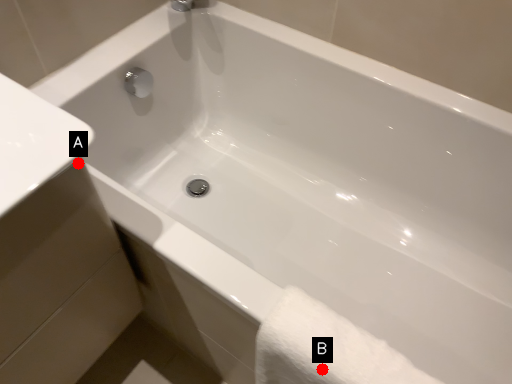
Question: Two points are circled on the image, labeled by A and B beside each circle. Which of the following is the closest to the observer?

Choices:
 (A) A is closer
 (B) B is closer

Answer: (B)